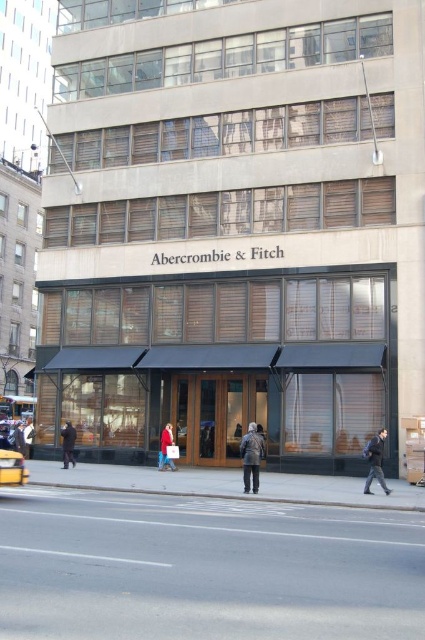
Question: Among these points, which one is nearest to the camera?

Choices:
 (A) (73, 429)
 (B) (3, 449)

Answer: (A)

Question: Is dark gray coat at center to the right of yellow rubber taxi at lower left from the viewer's perspective?

Choices:
 (A) yes
 (B) no

Answer: (A)

Question: Does dark gray jacket at center have a smaller size compared to red wool coat at lower center?

Choices:
 (A) yes
 (B) no

Answer: (B)

Question: Does dark gray jacket at center appear over dark gray jacket at lower left?

Choices:
 (A) yes
 (B) no

Answer: (A)

Question: Which point is farther from the camera taking this photo?

Choices:
 (A) (65, 448)
 (B) (382, 486)

Answer: (A)

Question: Which point is closer to the camera?

Choices:
 (A) dark gray jacket at center
 (B) dark gray jacket at lower left
 (C) light brown leather jacket at center
 (D) yellow rubber taxi at lower left

Answer: (D)